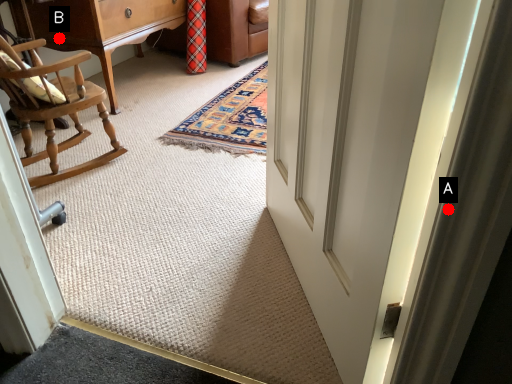
Question: Two points are circled on the image, labeled by A and B beside each circle. Which of the following is the closest to the observer?

Choices:
 (A) A is closer
 (B) B is closer

Answer: (A)